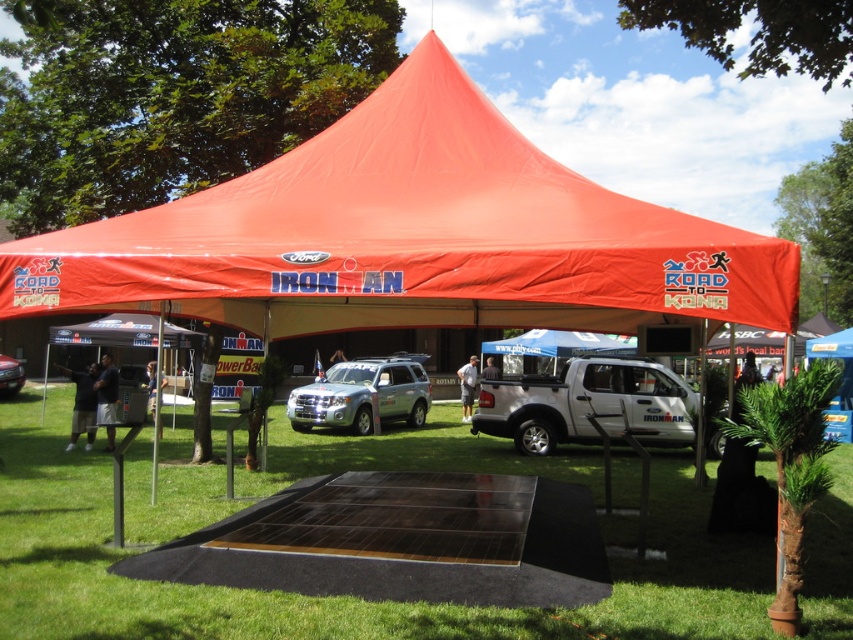
You are standing at the entrance of the event and need to locate the booth. You see two points marked on the ground. The first point is at coordinates point (326, 410) and the second is at point (9, 384). According to the spatial relationship between these points, which point is closer to the booth located under the tent?

Point (326, 410) is in front of point (9, 384), so the booth is closer to point (326, 410).

You are standing at the point marked by the coordinate point (339, 596) in the image. What is the color of the ground beneath you?

The green grass at lower center is represented by point (339, 596), so the ground beneath you is green.